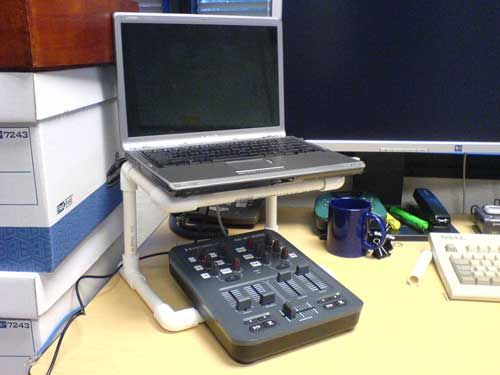
Find the location of a particular element. The image size is (500, 375). laptop is located at coordinates (207, 140).